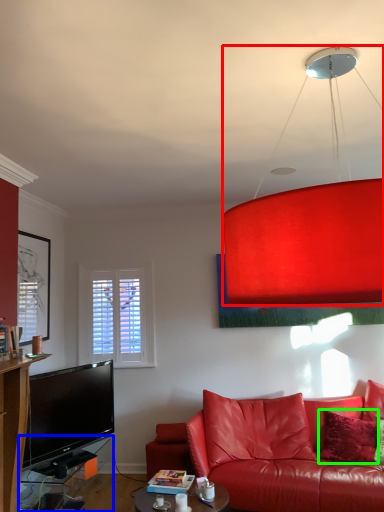
Question: Which object is positioned farthest from lamp (highlighted by a red box)? Select from table (highlighted by a blue box) and pillow (highlighted by a green box).

Choices:
 (A) table
 (B) pillow

Answer: (B)